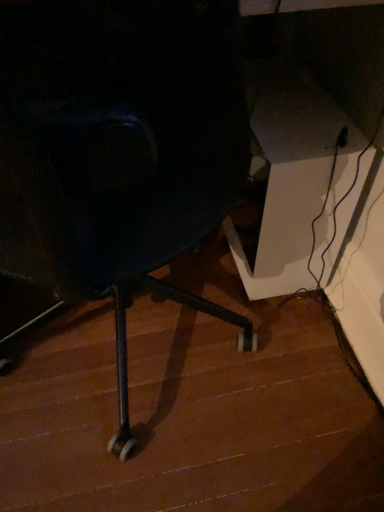
Where is `free space in front of white glossy table at right`? free space in front of white glossy table at right is located at coordinates (267, 342).